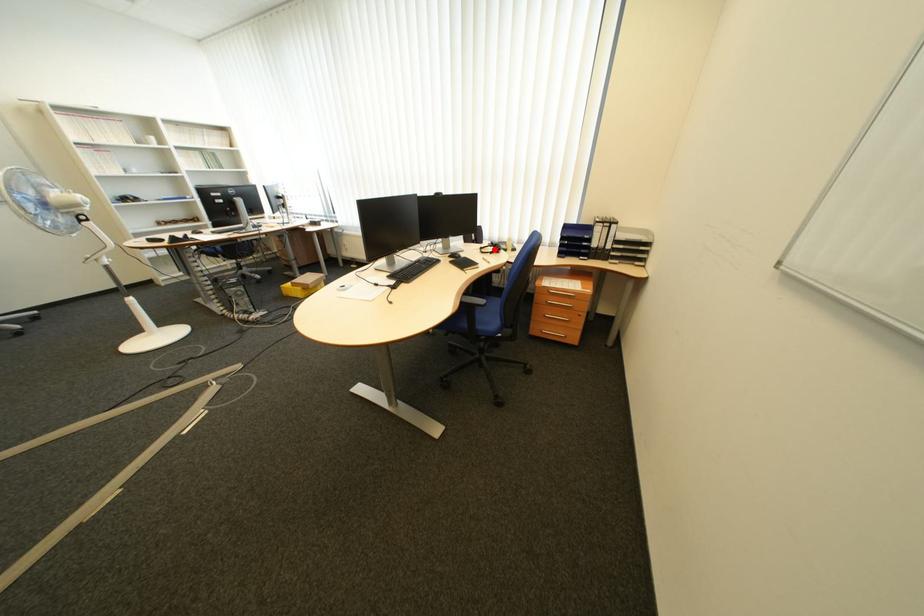
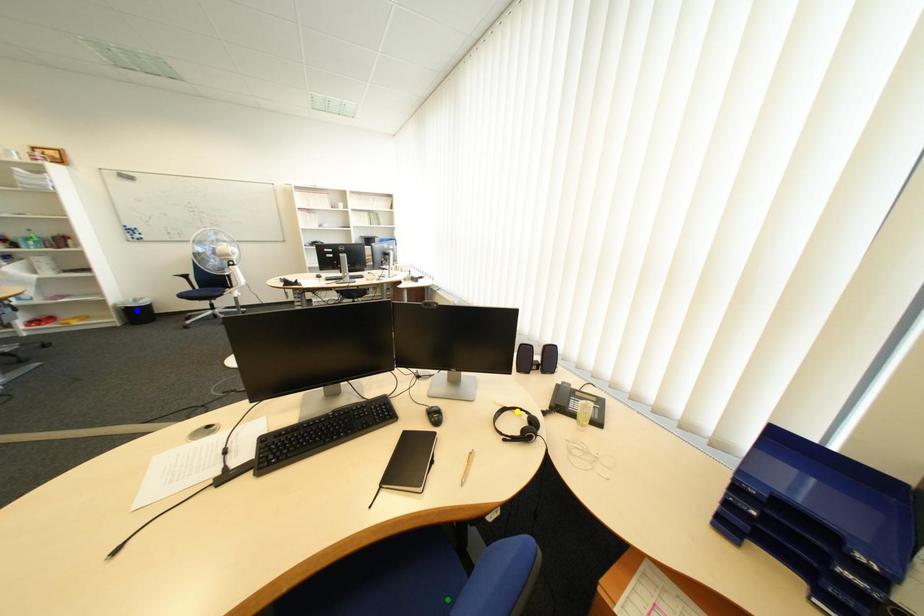
Question: I am providing you with two images of the same scene from different viewpoints. A red point is marked on the first image. You are given multiple points on the second image. Which point in image 2 represents the same 3d spot as the red point in image 1?

Choices:
 (A) yellow point
 (B) green point
 (C) blue point

Answer: (A)